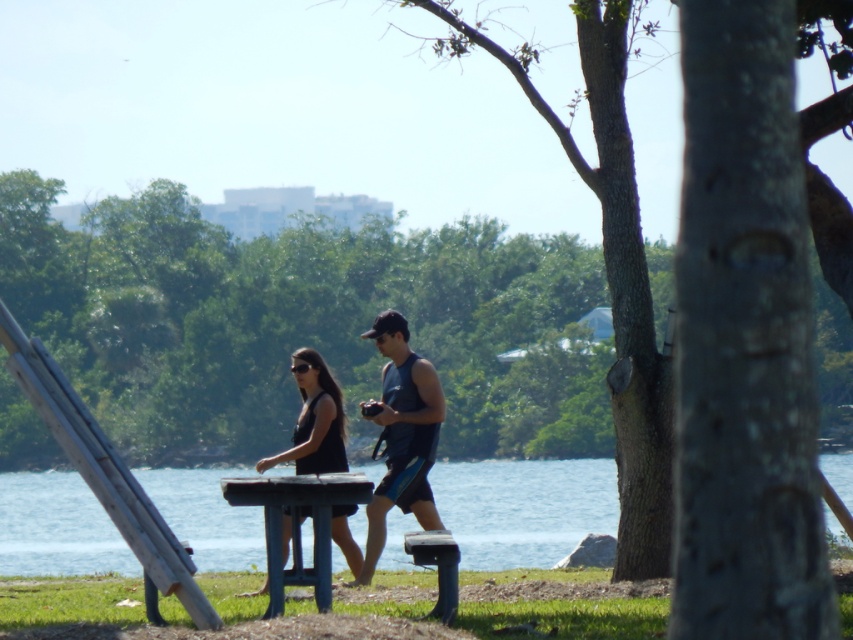
Question: Which point is closer to the camera?

Choices:
 (A) dark blue tank top at center
 (B) blue water at center
 (C) blue plastic picnic table at center
 (D) wooden park bench at center

Answer: (C)

Question: Does blue water at center have a lesser width compared to dark blue tank top at center?

Choices:
 (A) yes
 (B) no

Answer: (B)

Question: Can you confirm if blue water at center is positioned above blue plastic picnic table at center?

Choices:
 (A) yes
 (B) no

Answer: (B)

Question: Considering the real-world distances, which object is farthest from the wooden park bench at center?

Choices:
 (A) blue water at center
 (B) dark blue tank top at center
 (C) blue plastic picnic table at center

Answer: (A)

Question: Considering the real-world distances, which object is farthest from the brushed metal ladder at left?

Choices:
 (A) blue plastic picnic table at center
 (B) wooden park bench at center
 (C) dark blue tank top at center

Answer: (C)

Question: Does brushed metal ladder at left appear on the right side of blue plastic picnic table at center?

Choices:
 (A) yes
 (B) no

Answer: (B)